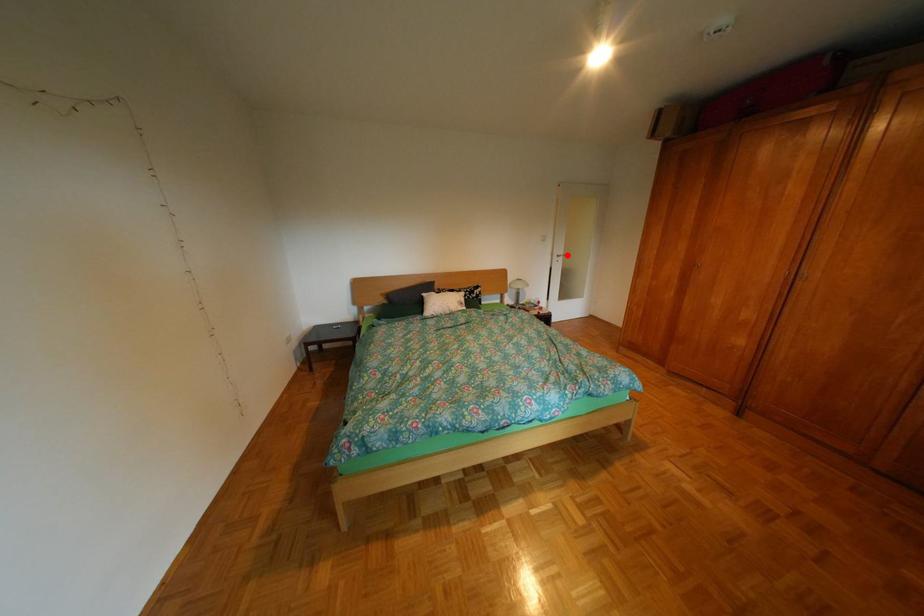
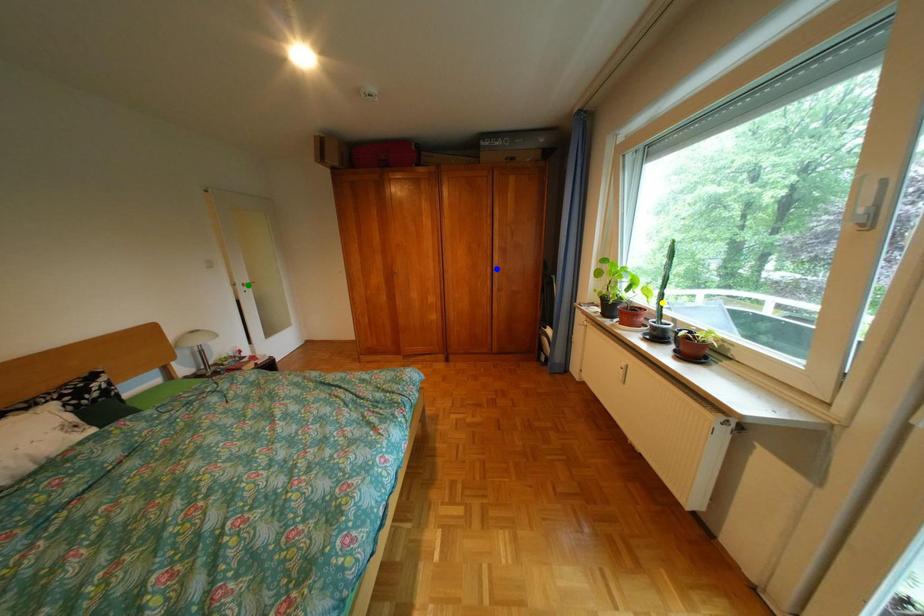
Question: I am providing you with two images of the same scene from different viewpoints. A red point is marked on the first image. You are given multiple points on the second image. Which mark in image 2 goes with the point in image 1?

Choices:
 (A) green point
 (B) yellow point
 (C) blue point

Answer: (A)